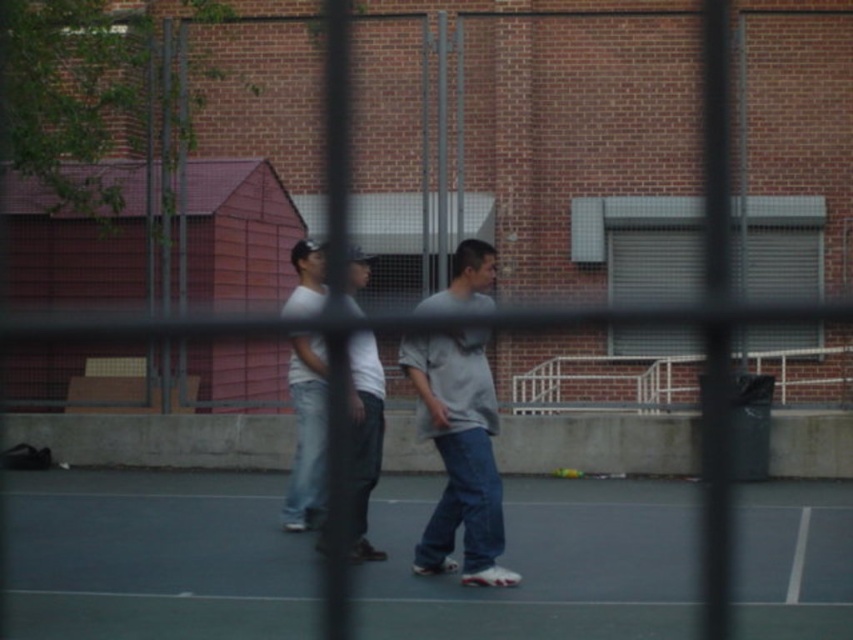
Question: Does metallic wire fence at center appear on the right side of white matte shirt at center?

Choices:
 (A) no
 (B) yes

Answer: (A)

Question: Does metallic wire fence at center come behind smooth gray court at center?

Choices:
 (A) no
 (B) yes

Answer: (B)

Question: Among these points, which one is nearest to the camera?

Choices:
 (A) (689, 496)
 (B) (490, 472)
 (C) (351, 342)
 (D) (834, 81)

Answer: (C)

Question: From the image, what is the correct spatial relationship of smooth gray court at center in relation to white matte t-shirt at center?

Choices:
 (A) below
 (B) above

Answer: (A)

Question: Which of the following is the closest to the observer?

Choices:
 (A) white matte t-shirt at center
 (B) white matte shirt at center

Answer: (B)

Question: Which point is closer to the camera?

Choices:
 (A) white matte shirt at center
 (B) smooth gray court at center
 (C) gray matte shirt at center
 (D) white matte t-shirt at center

Answer: (C)